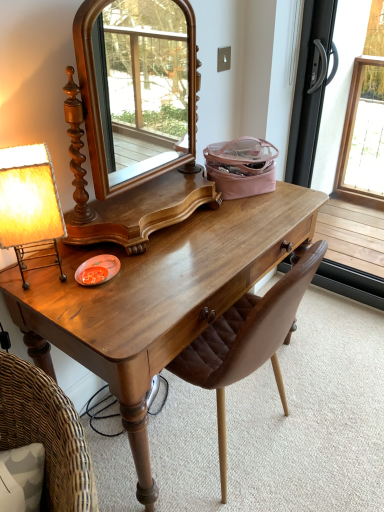
Measure the distance between point (279, 327) and camera.

The distance of point (279, 327) from camera is 3.67 feet.

Find the location of `brown leather chair at center`. brown leather chair at center is located at coordinates (247, 340).

Identify the location of transparent glass screen door at right. (307, 93).

Image resolution: width=384 pixels, height=512 pixels. What are the coordinates of `shiny brown wooden desk at center` in the screenshot? It's located at (158, 298).

Is brown leather chair at center not within matte yellow fabric lampshade at left?

Absolutely, brown leather chair at center is external to matte yellow fabric lampshade at left.

Which point is more forward, (303, 258) or (64, 232)?

The point (303, 258) is closer to the camera.

From a real-world perspective, between brown leather chair at center and matte yellow fabric lampshade at left, who is vertically lower?

brown leather chair at center.

Is matte yellow fabric lampshade at left outside of brown leather chair at center?

Yes, matte yellow fabric lampshade at left is outside of brown leather chair at center.

Find the location of a particular element. The image size is (384, 512). chair behind the matte yellow fabric lampshade at left is located at coordinates (247, 340).

Which of these two, matte yellow fabric lampshade at left or brown leather chair at center, is thinner?

With smaller width is matte yellow fabric lampshade at left.

Which point is more distant from viewer, [269,309] or [247,268]?

The point [247,268] is farther.

Is brown leather chair at center looking in the opposite direction of shiny brown wooden desk at center?

brown leather chair at center is not turned away from shiny brown wooden desk at center.

Do you think brown leather chair at center is within shiny brown wooden desk at center, or outside of it?

brown leather chair at center is spatially situated outside shiny brown wooden desk at center.

Locate an element on the screen. The width and height of the screenshot is (384, 512). chair on the left side of transparent glass screen door at right is located at coordinates click(247, 340).

Is brown leather chair at center not within transparent glass screen door at right?

Absolutely, brown leather chair at center is external to transparent glass screen door at right.

Which object is wider, brown leather chair at center or transparent glass screen door at right?

brown leather chair at center is wider.

From a real-world perspective, is brown leather chair at center positioned above or below transparent glass screen door at right?

In terms of real-world spatial position, brown leather chair at center is below transparent glass screen door at right.

Considering the relative positions of transparent glass screen door at right and brown leather chair at center in the image provided, is transparent glass screen door at right in front of brown leather chair at center?

No, it is behind brown leather chair at center.

Could you tell me if transparent glass screen door at right is turned towards brown leather chair at center?

Yes, transparent glass screen door at right is oriented towards brown leather chair at center.

Consider the image. Does transparent glass screen door at right have a larger size compared to brown leather chair at center?

Yes, transparent glass screen door at right is bigger than brown leather chair at center.

Find the location of `screen door on the right of shiny brown wooden desk at center`. screen door on the right of shiny brown wooden desk at center is located at coordinates (307, 93).

From the image's perspective, is transparent glass screen door at right above shiny brown wooden desk at center?

Correct, transparent glass screen door at right appears higher than shiny brown wooden desk at center in the image.

Based on the photo, is transparent glass screen door at right touching shiny brown wooden desk at center?

There is a gap between transparent glass screen door at right and shiny brown wooden desk at center.

From the picture: Can you confirm if transparent glass screen door at right is bigger than shiny brown wooden desk at center?

Incorrect, transparent glass screen door at right is not larger than shiny brown wooden desk at center.

Is point (16, 181) positioned in front of point (145, 474)?

Yes, it is in front of point (145, 474).

The image size is (384, 512). What are the coordinates of `desk below the matte yellow fabric lampshade at left (from the image's perspective)` in the screenshot? It's located at (158, 298).

What's the angular difference between matte yellow fabric lampshade at left and shiny brown wooden desk at center's facing directions?

The angular difference between matte yellow fabric lampshade at left and shiny brown wooden desk at center is 59.7 degrees.

In terms of width, does matte yellow fabric lampshade at left look wider or thinner when compared to shiny brown wooden desk at center?

Clearly, matte yellow fabric lampshade at left has less width compared to shiny brown wooden desk at center.

This screenshot has width=384, height=512. What are the coordinates of `chair below the matte yellow fabric lampshade at left (from the image's perspective)` in the screenshot? It's located at (247, 340).

The width and height of the screenshot is (384, 512). In the image, there is a matte yellow fabric lampshade at left. In order to click on chair below it (from a real-world perspective) in this screenshot , I will do click(x=247, y=340).

From the image, which object appears to be farther from matte yellow fabric lampshade at left, transparent glass screen door at right or brown leather chair at center?

The object further to matte yellow fabric lampshade at left is transparent glass screen door at right.

Based on their spatial positions, is matte yellow fabric lampshade at left or transparent glass screen door at right further from shiny brown wooden desk at center?

transparent glass screen door at right is positioned further to the anchor shiny brown wooden desk at center.

When comparing their distances from matte yellow fabric lampshade at left, does shiny brown wooden desk at center or transparent glass screen door at right seem closer?

Among the two, shiny brown wooden desk at center is located nearer to matte yellow fabric lampshade at left.

Looking at the image, which one is located further to shiny brown wooden desk at center, brown leather chair at center or matte yellow fabric lampshade at left?

matte yellow fabric lampshade at left.

From the image, which object appears to be farther from transparent glass screen door at right, brown leather chair at center or matte yellow fabric lampshade at left?

matte yellow fabric lampshade at left is further to transparent glass screen door at right.

When comparing their distances from brown leather chair at center, does shiny brown wooden desk at center or transparent glass screen door at right seem closer?

shiny brown wooden desk at center lies closer to brown leather chair at center than the other object.

When comparing their distances from brown leather chair at center, does transparent glass screen door at right or matte yellow fabric lampshade at left seem closer?

Among the two, matte yellow fabric lampshade at left is located nearer to brown leather chair at center.

Considering their positions, is brown leather chair at center positioned further to matte yellow fabric lampshade at left than transparent glass screen door at right?

The object further to matte yellow fabric lampshade at left is transparent glass screen door at right.

This screenshot has height=512, width=384. I want to click on desk between transparent glass screen door at right and brown leather chair at center vertically, so click(158, 298).

Find the location of a particular element. desk located between matte yellow fabric lampshade at left and brown leather chair at center in the left-right direction is located at coordinates (158, 298).

Locate an element on the screen. The height and width of the screenshot is (512, 384). chair between matte yellow fabric lampshade at left and transparent glass screen door at right in the horizontal direction is located at coordinates (247, 340).

I want to click on desk between matte yellow fabric lampshade at left and transparent glass screen door at right, so click(158, 298).